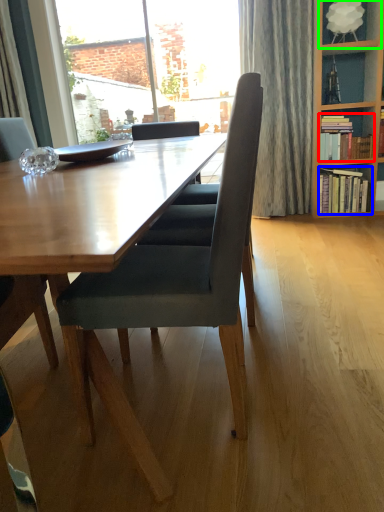
Question: Considering the real-world distances, which object is closest to book (highlighted by a red box)? book (highlighted by a blue box) or shelf (highlighted by a green box).

Choices:
 (A) book
 (B) shelf

Answer: (A)